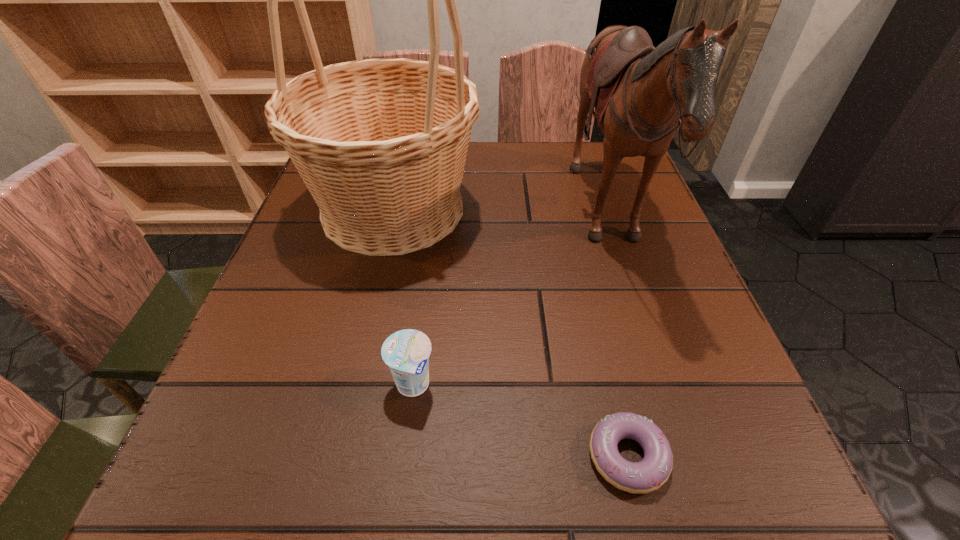
Locate an element on the screen. This screenshot has height=540, width=960. the tallest object is located at coordinates (381, 144).

Where is `saddle`? saddle is located at coordinates (641, 94).

Where is `the third tallest object`? The width and height of the screenshot is (960, 540). the third tallest object is located at coordinates (406, 352).

Where is `the third farthest object`? This screenshot has height=540, width=960. the third farthest object is located at coordinates (406, 352).

Identify the location of doughnut. The width and height of the screenshot is (960, 540). (649, 474).

The image size is (960, 540). I want to click on the nearest object, so click(649, 474).

The image size is (960, 540). Identify the location of free spot located 0.390m on the front of the basket. (330, 479).

This screenshot has height=540, width=960. What are the coordinates of `vacant space situated 0.110m on the back of the saddle` in the screenshot? It's located at (523, 219).

Where is `vacant space located 0.370m on the back of the saddle`? This screenshot has height=540, width=960. vacant space located 0.370m on the back of the saddle is located at coordinates (403, 219).

The height and width of the screenshot is (540, 960). Find the location of `free spot located on the back of the saddle`. free spot located on the back of the saddle is located at coordinates (542, 219).